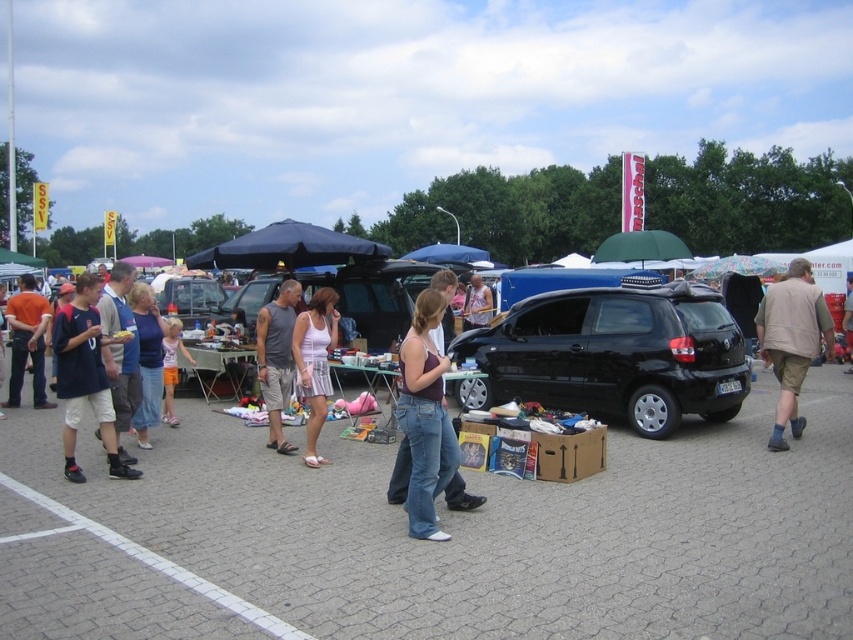
Question: Can you confirm if denim jeans at center is positioned to the left of matte gray tank top at center?

Choices:
 (A) yes
 (B) no

Answer: (B)

Question: Observing the image, what is the correct spatial positioning of denim shorts at center in reference to metallic silver car at center?

Choices:
 (A) left
 (B) right

Answer: (B)

Question: Which of these objects is positioned farthest from the denim shorts at center?

Choices:
 (A) black matte hatchback at center
 (B) denim jeans at center

Answer: (A)

Question: Which object is closer to the camera taking this photo?

Choices:
 (A) beige fabric jacket at center-right
 (B) orange cotton shorts at center
 (C) denim jeans at center
 (D) black matte hatchback at center

Answer: (C)

Question: Which is nearer to the orange cotton shorts at center?

Choices:
 (A) white fabric dress at center
 (B) beige fabric jacket at center-right
 (C) matte gray tank top at center

Answer: (C)

Question: Can you confirm if black matte hatchback at center is positioned above beige fabric jacket at center-right?

Choices:
 (A) yes
 (B) no

Answer: (B)